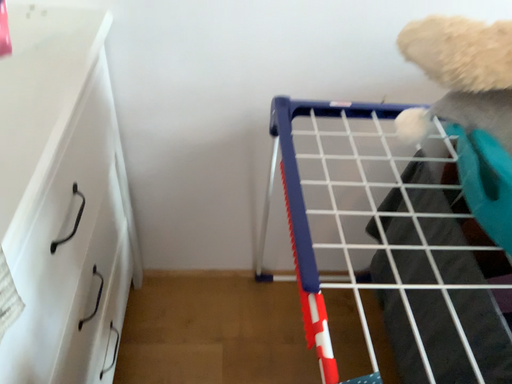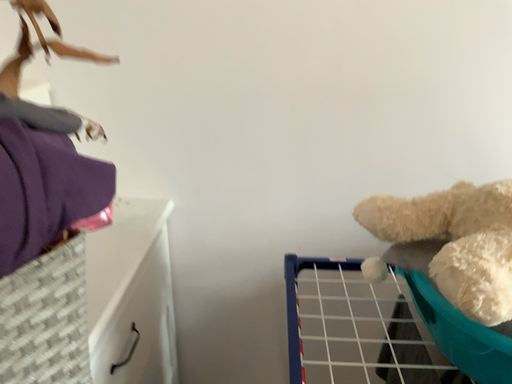
Question: How did the camera likely rotate when shooting the video?

Choices:
 (A) rotated right
 (B) rotated left

Answer: (B)